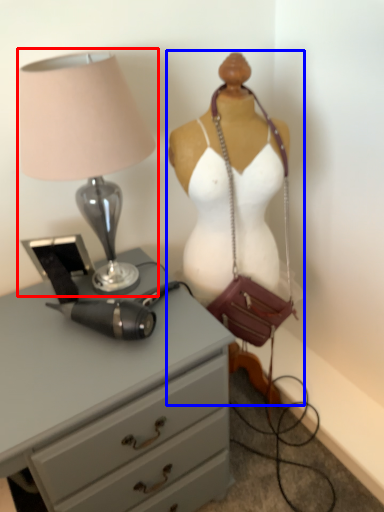
Question: Which object appears closest to the camera in this image, lamp (highlighted by a red box) or mannequin (highlighted by a blue box)?

Choices:
 (A) lamp
 (B) mannequin

Answer: (A)